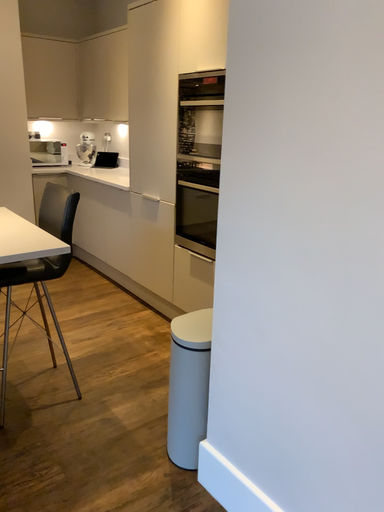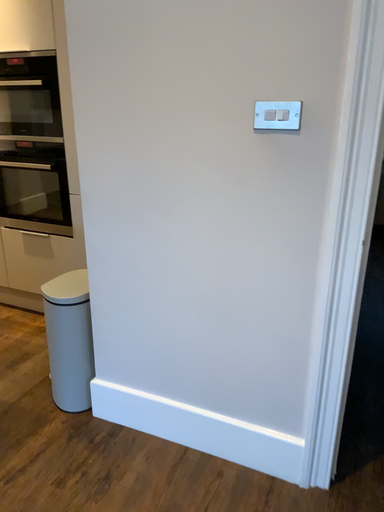
Question: Which way did the camera rotate in the video?

Choices:
 (A) rotated left
 (B) rotated right

Answer: (B)